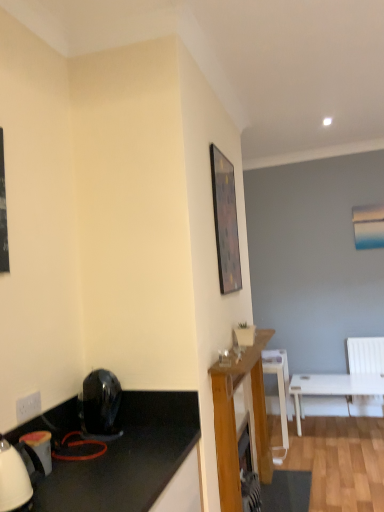
Question: In the image, is black glossy hairdryer at lower left, the second appliance from the front, positioned in front of or behind transparent glass coffee cup at center?

Choices:
 (A) front
 (B) behind

Answer: (A)

Question: Considering the positions of black glossy hairdryer at lower left, the second appliance from the front, and transparent glass coffee cup at center in the image, is black glossy hairdryer at lower left, the second appliance from the front, wider or thinner than transparent glass coffee cup at center?

Choices:
 (A) wide
 (B) thin

Answer: (A)

Question: Which object is positioned farthest from the white glossy kettle at lower left, which appears as the 2th appliance when viewed from the right?

Choices:
 (A) white glossy chair at center
 (B) transparent glass coffee cup at center
 (C) white plastic power outlet at lower left
 (D) wooden framed picture at upper center
 (E) black glossy hairdryer at lower left, which ranks as the first appliance in back-to-front order

Answer: (A)

Question: Which is nearer to the white glossy chair at center?

Choices:
 (A) white glossy kettle at lower left, marked as the 2th appliance in a back-to-front arrangement
 (B) wooden framed picture at upper center
 (C) transparent glass coffee cup at center
 (D) black glossy hairdryer at lower left, which is the first appliance in right-to-left order
 (E) white plastic power outlet at lower left

Answer: (B)